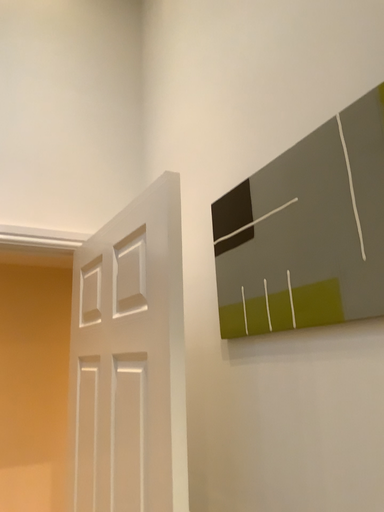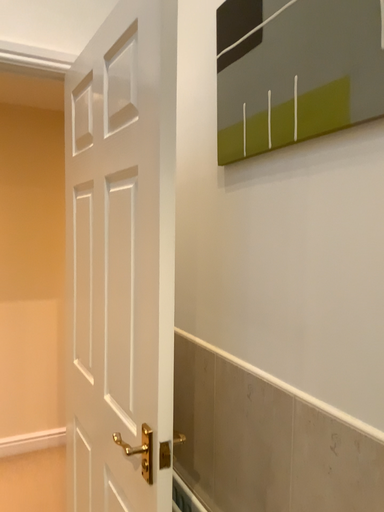
Question: Which way did the camera rotate in the video?

Choices:
 (A) rotated upward
 (B) rotated downward

Answer: (B)